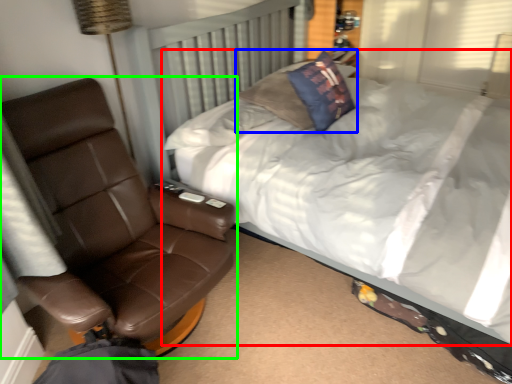
Question: Which object is positioned farthest from bed (highlighted by a red box)? Select from pillow (highlighted by a blue box) and chair (highlighted by a green box).

Choices:
 (A) pillow
 (B) chair

Answer: (B)